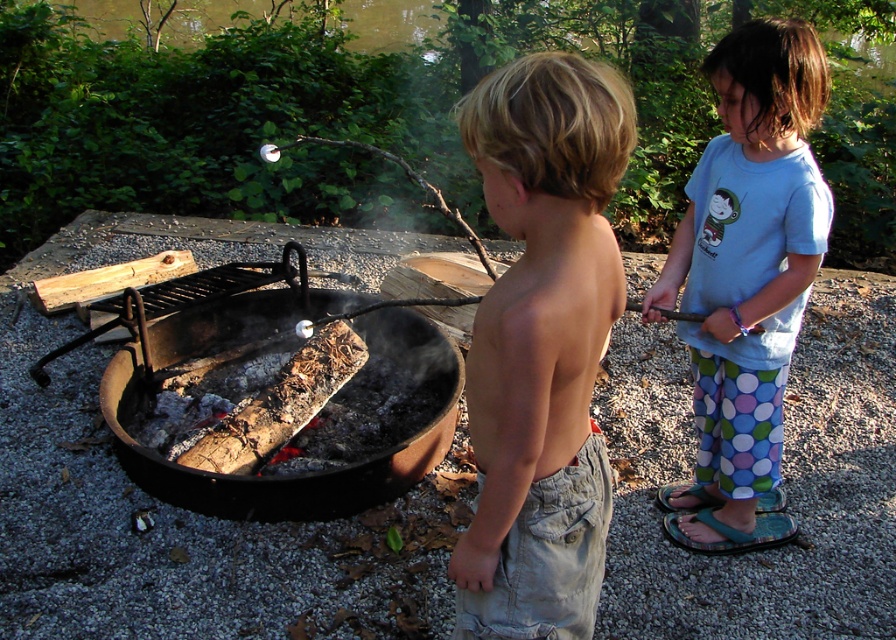
You are a photographer trying to capture a closeup shot of the light brown hair at center and the charred wood fire pit at center. Which object would require a wider lens aperture to ensure proper focus?

The charred wood fire pit at center requires a wider lens aperture because it is thicker than the light brown hair at center, necessitating a larger opening to capture enough light for focus.